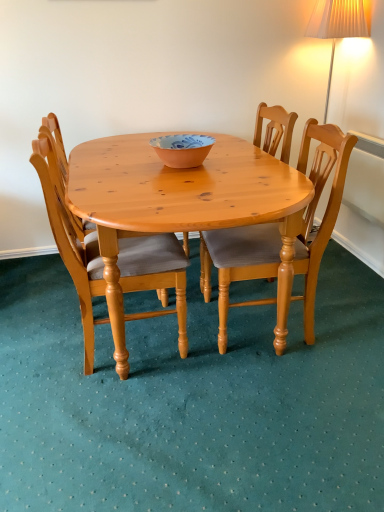
Identify the location of pine wood chair at center, which is the third chair from right to left. (70, 233).

Can you tell me how much light brown wooden chair at center, arranged as the 1th chair when viewed from the right, and wooden chair at center, which is the second chair in left-to-right order, differ in facing direction?

There is a 8.66e-05-degree angle between the facing directions of light brown wooden chair at center, arranged as the 1th chair when viewed from the right, and wooden chair at center, which is the second chair in left-to-right order.

Based on the photo, does light brown wooden chair at center, positioned as the 3th chair in left-to-right order, have a lesser width compared to wooden chair at center, which is the second chair in left-to-right order?

No.

Is light brown wooden chair at center, arranged as the 1th chair when viewed from the right, spatially inside wooden chair at center, which is the second chair in left-to-right order, or outside of it?

light brown wooden chair at center, arranged as the 1th chair when viewed from the right, is located beyond the bounds of wooden chair at center, which is the second chair in left-to-right order.

From the image's perspective, which is above, pine wood chair at center, the 1th chair when ordered from left to right, or light brown wooden chair at center, arranged as the 1th chair when viewed from the right?

light brown wooden chair at center, arranged as the 1th chair when viewed from the right.

Would you say pine wood chair at center, the 1th chair when ordered from left to right, is inside or outside light brown wooden chair at center, positioned as the 3th chair in left-to-right order?

pine wood chair at center, the 1th chair when ordered from left to right, is not enclosed by light brown wooden chair at center, positioned as the 3th chair in left-to-right order.

Can you tell me how much pine wood chair at center, the 1th chair when ordered from left to right, and light brown wooden chair at center, positioned as the 3th chair in left-to-right order, differ in facing direction?

The facing directions of pine wood chair at center, the 1th chair when ordered from left to right, and light brown wooden chair at center, positioned as the 3th chair in left-to-right order, are 178 degrees apart.

Does pine wood chair at center, which is the third chair from right to left, turn towards light brown wooden chair at center, positioned as the 3th chair in left-to-right order?

Yes, pine wood chair at center, which is the third chair from right to left, is facing light brown wooden chair at center, positioned as the 3th chair in left-to-right order.

Can you confirm if wooden chair at center, the second chair from the right, is taller than matte orange bowl at center?

Indeed, wooden chair at center, the second chair from the right, has a greater height compared to matte orange bowl at center.

Is wooden chair at center, which is the second chair in left-to-right order, positioned in front of matte orange bowl at center?

No, it is not.

Is wooden chair at center, the second chair from the right, beside matte orange bowl at center?

No, wooden chair at center, the second chair from the right, is not in contact with matte orange bowl at center.

Is wooden chair at center, which is the second chair in left-to-right order, smaller than matte orange bowl at center?

Actually, wooden chair at center, which is the second chair in left-to-right order, might be larger than matte orange bowl at center.

Looking at this image, does pine wood chair at center, the 1th chair when ordered from left to right, have a smaller size compared to matte orange bowl at center?

No.

Would you say pine wood chair at center, which is the third chair from right to left, is outside matte orange bowl at center?

Absolutely, pine wood chair at center, which is the third chair from right to left, is external to matte orange bowl at center.

Considering the relative positions of pine wood chair at center, the 1th chair when ordered from left to right, and matte orange bowl at center in the image provided, is pine wood chair at center, the 1th chair when ordered from left to right, to the right of matte orange bowl at center from the viewer's perspective?

In fact, pine wood chair at center, the 1th chair when ordered from left to right, is to the left of matte orange bowl at center.

Would you consider matte orange bowl at center to be distant from light brown wooden chair at center, arranged as the 1th chair when viewed from the right?

That's not correct — matte orange bowl at center is a little close to light brown wooden chair at center, arranged as the 1th chair when viewed from the right.

Does matte orange bowl at center appear on the right side of light brown wooden chair at center, arranged as the 1th chair when viewed from the right?

No, matte orange bowl at center is not to the right of light brown wooden chair at center, arranged as the 1th chair when viewed from the right.

In the scene shown: Is matte orange bowl at center facing towards light brown wooden chair at center, arranged as the 1th chair when viewed from the right?

No.

Is matte orange bowl at center not inside light brown wooden chair at center, arranged as the 1th chair when viewed from the right?

Yes, matte orange bowl at center is outside of light brown wooden chair at center, arranged as the 1th chair when viewed from the right.

Is matte orange bowl at center at the right side of wooden chair at center, the second chair from the right?

In fact, matte orange bowl at center is to the left of wooden chair at center, the second chair from the right.

Which is in front, matte orange bowl at center or wooden chair at center, the second chair from the right?

matte orange bowl at center is in front.

Is wooden chair at center, which is the second chair in left-to-right order, completely or partially inside matte orange bowl at center?

No, wooden chair at center, which is the second chair in left-to-right order, is not inside matte orange bowl at center.

Does matte orange bowl at center have a lesser height compared to wooden chair at center, which is the second chair in left-to-right order?

Yes, matte orange bowl at center is shorter than wooden chair at center, which is the second chair in left-to-right order.

Locate an element on the screen. This screenshot has width=384, height=512. chair to the left of matte orange bowl at center is located at coordinates (70, 233).

Is matte orange bowl at center to the left or to the right of pine wood chair at center, which is the third chair from right to left, in the image?

In the image, matte orange bowl at center appears on the right side of pine wood chair at center, which is the third chair from right to left.

Is matte orange bowl at center next to pine wood chair at center, the 1th chair when ordered from left to right, and touching it?

No, matte orange bowl at center is not in contact with pine wood chair at center, the 1th chair when ordered from left to right.

Can you confirm if matte orange bowl at center is taller than pine wood chair at center, which is the third chair from right to left?

In fact, matte orange bowl at center may be shorter than pine wood chair at center, which is the third chair from right to left.

Find the location of `chair to the right of wooden chair at center, which is the second chair in left-to-right order`. chair to the right of wooden chair at center, which is the second chair in left-to-right order is located at coordinates (316, 207).

Locate an element on the screen. This screenshot has width=384, height=512. the 1st chair directly above the pine wood chair at center, which is the third chair from right to left (from a real-world perspective) is located at coordinates (316, 207).

When comparing their distances from wooden chair at center, the second chair from the right, does pine wood chair at center, the 1th chair when ordered from left to right, or matte orange bowl at center seem further?

pine wood chair at center, the 1th chair when ordered from left to right, is further to wooden chair at center, the second chair from the right.

Looking at the image, which one is located further to matte orange bowl at center, light brown wooden chair at center, positioned as the 3th chair in left-to-right order, or wooden chair at center, the second chair from the right?

light brown wooden chair at center, positioned as the 3th chair in left-to-right order, is positioned further to the anchor matte orange bowl at center.

Based on their spatial positions, is matte orange bowl at center or light brown wooden chair at center, arranged as the 1th chair when viewed from the right, further from wooden chair at center, the second chair from the right?

matte orange bowl at center is further to wooden chair at center, the second chair from the right.

When comparing their distances from pine wood chair at center, the 1th chair when ordered from left to right, does wooden chair at center, which is the second chair in left-to-right order, or light brown wooden chair at center, positioned as the 3th chair in left-to-right order, seem further?

light brown wooden chair at center, positioned as the 3th chair in left-to-right order, is further to pine wood chair at center, the 1th chair when ordered from left to right.

From the image, which object appears to be nearer to wooden chair at center, the second chair from the right, matte orange bowl at center or pine wood chair at center, the 1th chair when ordered from left to right?

matte orange bowl at center is closer to wooden chair at center, the second chair from the right.

When comparing their distances from pine wood chair at center, the 1th chair when ordered from left to right, does matte orange bowl at center or light brown wooden chair at center, positioned as the 3th chair in left-to-right order, seem further?

matte orange bowl at center.

When comparing their distances from wooden chair at center, which is the second chair in left-to-right order, does pine wood chair at center, the 1th chair when ordered from left to right, or light brown wooden chair at center, arranged as the 1th chair when viewed from the right, seem closer?

Among the two, light brown wooden chair at center, arranged as the 1th chair when viewed from the right, is located nearer to wooden chair at center, which is the second chair in left-to-right order.

Estimate the real-world distances between objects in this image. Which object is closer to wooden chair at center, which is the second chair in left-to-right order, light brown wooden chair at center, positioned as the 3th chair in left-to-right order, or matte orange bowl at center?

The object closer to wooden chair at center, which is the second chair in left-to-right order, is light brown wooden chair at center, positioned as the 3th chair in left-to-right order.

This screenshot has width=384, height=512. Find the location of `chair situated between pine wood chair at center, the 1th chair when ordered from left to right, and light brown wooden chair at center, arranged as the 1th chair when viewed from the right, from left to right`. chair situated between pine wood chair at center, the 1th chair when ordered from left to right, and light brown wooden chair at center, arranged as the 1th chair when viewed from the right, from left to right is located at coordinates (230, 249).

The image size is (384, 512). I want to click on bowl between pine wood chair at center, which is the third chair from right to left, and wooden chair at center, the second chair from the right, from front to back, so [x=182, y=149].

Locate an element on the screen. The width and height of the screenshot is (384, 512). bowl between pine wood chair at center, the 1th chair when ordered from left to right, and light brown wooden chair at center, positioned as the 3th chair in left-to-right order, from left to right is located at coordinates (182, 149).

In order to click on bowl between light brown wooden chair at center, positioned as the 3th chair in left-to-right order, and wooden chair at center, which is the second chair in left-to-right order, from front to back in this screenshot , I will do `click(182, 149)`.